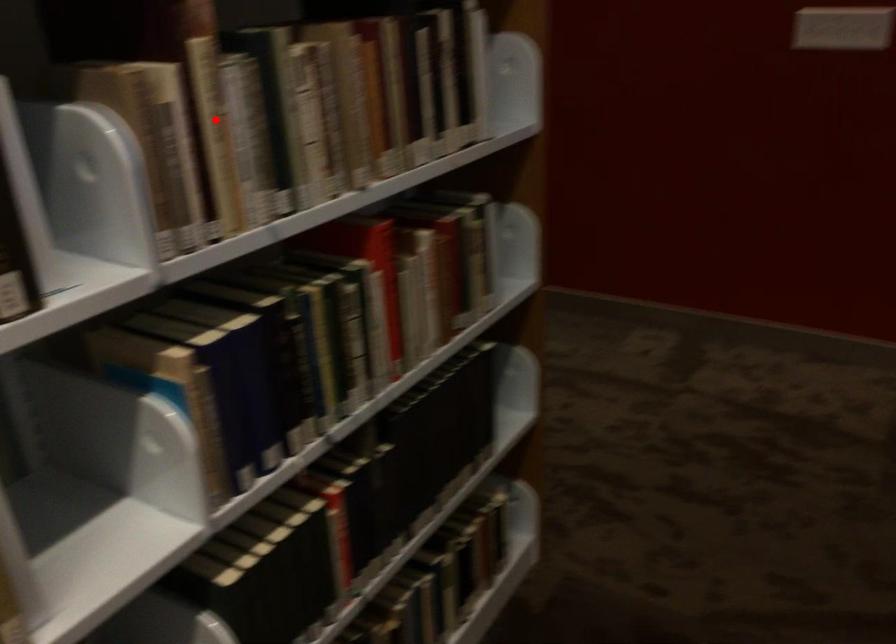
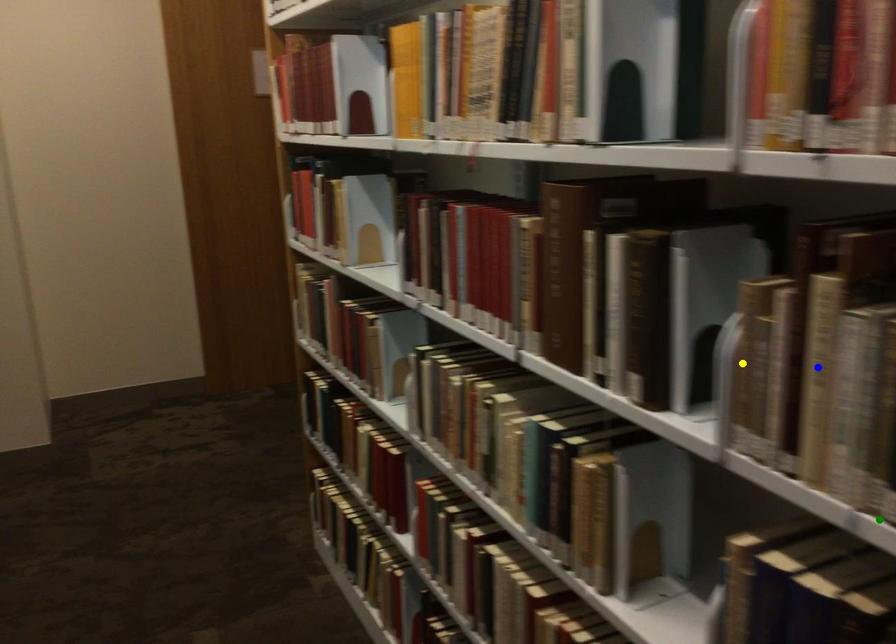
Question: I am providing you with two images of the same scene from different viewpoints. A red point is marked on the first image. You are given multiple points on the second image. Can you choose the point in image 2 that corresponds to the point in image 1?

Choices:
 (A) yellow point
 (B) green point
 (C) blue point

Answer: (C)